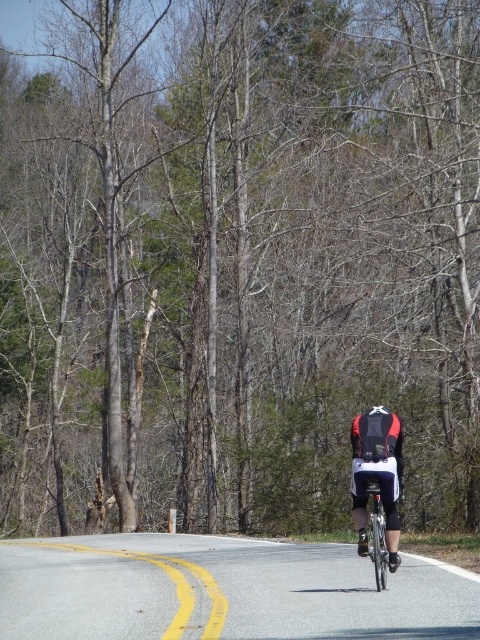
You are a photographer trying to capture a closeup shot of the cyclist. You have a camera with a 50mm lens that can focus on objects within 30 inches. Can you get a clear shot of both the red and black cycling jersey at center and the matte black helmet at center without moving your camera position?

The red and black cycling jersey at center is 31.55 inches from the matte black helmet at center, which is beyond the 30 inches focusing range of your camera lens. Therefore, you cannot capture both clearly in one shot without moving the camera.

You are a photographer positioned at the side of the road. You want to capture a clear photo of the cyclist wearing the red and black cycling jersey at center and the matte black helmet at center. Based on their positions, which object will appear larger in the photo?

The red and black cycling jersey at center will appear larger in the photo because it is much taller than the matte black helmet at center.

You are a photographer positioned at the center of the image. You want to take a photo of the red and black cycling jersey at center. Where should you aim your camera to capture the subject?

The red and black cycling jersey at center is located at the coordinates point (376, 476). Aim your camera at that point to capture the subject.